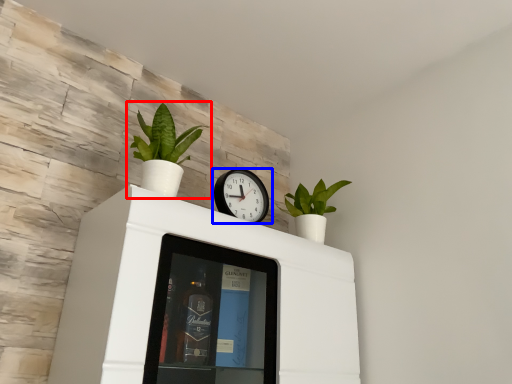
Question: Which object appears farthest to the camera in this image, houseplant (highlighted by a red box) or wall clock (highlighted by a blue box)?

Choices:
 (A) houseplant
 (B) wall clock

Answer: (B)